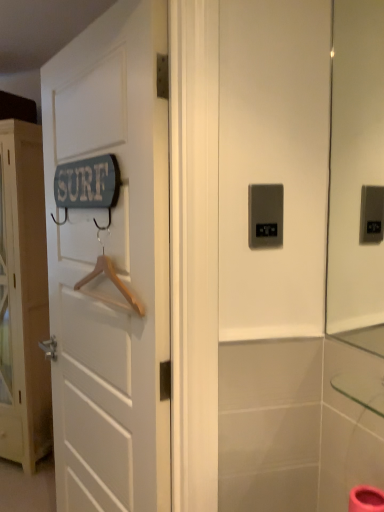
Question: Can you confirm if white wooden door at left, positioned as the 2th door in right-to-left order, is positioned to the right of white wooden door at left, positioned as the 2th door in back-to-front order?

Choices:
 (A) no
 (B) yes

Answer: (A)

Question: Are white wooden door at left, positioned as the 2th door in right-to-left order, and white wooden door at left, positioned as the 2th door in back-to-front order, beside each other?

Choices:
 (A) yes
 (B) no

Answer: (B)

Question: From a real-world perspective, is white wooden door at left, positioned as the 2th door in right-to-left order, under white wooden door at left, acting as the first door starting from the front?

Choices:
 (A) no
 (B) yes

Answer: (B)

Question: Is white wooden door at left, positioned as the 2th door in right-to-left order, not within white wooden door at left, positioned as the 2th door in back-to-front order?

Choices:
 (A) no
 (B) yes

Answer: (B)

Question: From the image's perspective, is white wooden door at left, positioned as the first door in left-to-right order, below white wooden door at left, the first door positioned from the right?

Choices:
 (A) no
 (B) yes

Answer: (B)

Question: From a real-world perspective, is white wooden door at left, the 2th door from the front, on top of white wooden door at left, the 2th door positioned from the left?

Choices:
 (A) no
 (B) yes

Answer: (A)

Question: Is wooden hanger at left positioned before white wooden door at left, the 2th door from the front?

Choices:
 (A) yes
 (B) no

Answer: (A)

Question: From the image's perspective, is wooden hanger at left on white wooden door at left, the 2th door from the front?

Choices:
 (A) no
 (B) yes

Answer: (B)

Question: Could you tell me if wooden hanger at left is facing white wooden door at left, marked as the 1th door in a back-to-front arrangement?

Choices:
 (A) yes
 (B) no

Answer: (B)

Question: Does wooden hanger at left touch white wooden door at left, marked as the 1th door in a back-to-front arrangement?

Choices:
 (A) no
 (B) yes

Answer: (A)

Question: Considering the relative sizes of wooden hanger at left and white wooden door at left, the 2th door from the front, in the image provided, is wooden hanger at left smaller than white wooden door at left, the 2th door from the front,?

Choices:
 (A) no
 (B) yes

Answer: (B)

Question: Is wooden hanger at left outside white wooden door at left, positioned as the first door in left-to-right order?

Choices:
 (A) no
 (B) yes

Answer: (B)

Question: Considering the relative sizes of wooden hanger at left and white wooden door at left, the 2th door positioned from the left, in the image provided, is wooden hanger at left taller than white wooden door at left, the 2th door positioned from the left,?

Choices:
 (A) no
 (B) yes

Answer: (A)